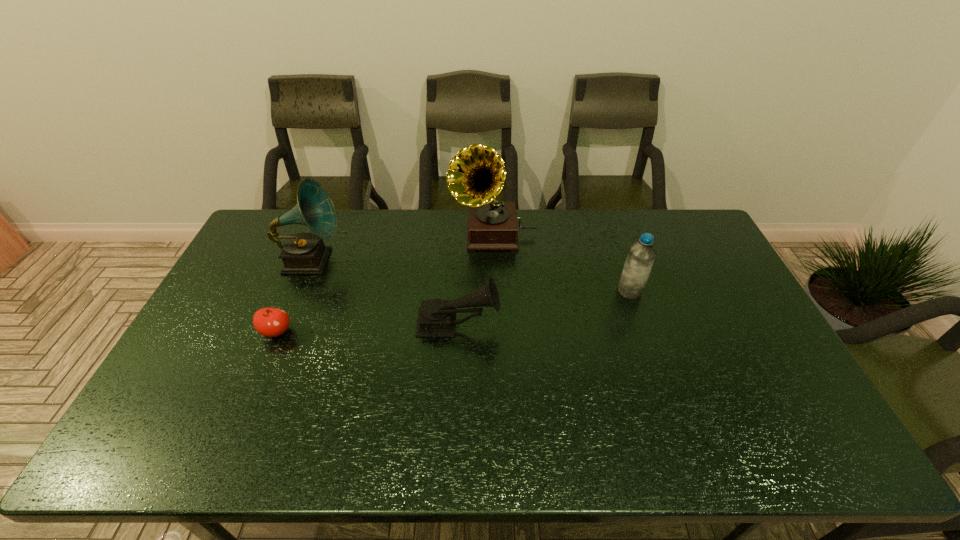
The width and height of the screenshot is (960, 540). Identify the location of the leftmost phonograph_record. (304, 253).

Identify the location of the rightmost object. This screenshot has height=540, width=960. (641, 255).

Where is `the third shortest object`? Image resolution: width=960 pixels, height=540 pixels. the third shortest object is located at coordinates (641, 255).

Locate an element on the screen. Image resolution: width=960 pixels, height=540 pixels. the shortest phonograph_record is located at coordinates (436, 318).

At what (x,y) coordinates should I click in order to perform the action: click on the nearest phonograph_record. Please return your answer as a coordinate pair (x, y). Looking at the image, I should click on (436, 318).

Find the location of `apple`. apple is located at coordinates (271, 322).

In order to click on vacant region located from the horn of the leftmost phonograph_record in this screenshot , I will do `click(428, 261)`.

In order to click on vacant space situated on the front of the third tallest object in this screenshot , I will do `click(664, 393)`.

Where is `free space located from the horn of the nearest phonograph_record`? free space located from the horn of the nearest phonograph_record is located at coordinates (624, 325).

I want to click on vacant region located on the left of the shortest object, so click(232, 332).